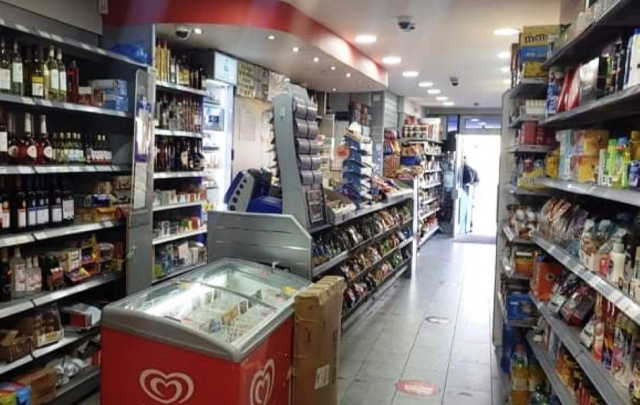
Locate an element on the screen. red drop down ceiling is located at coordinates (333, 52).